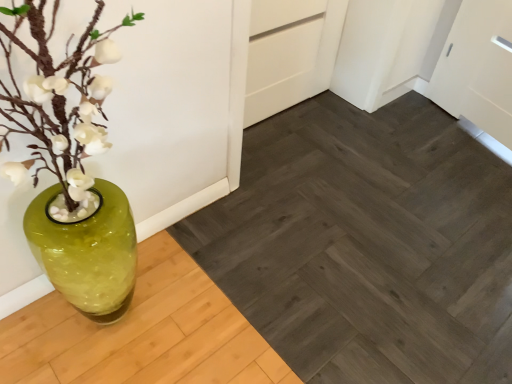
The width and height of the screenshot is (512, 384). I want to click on dark gray wood plank at center, so click(x=367, y=244).

What is the approximate width of dark gray wood plank at center?

dark gray wood plank at center is 7.97 feet wide.

Describe the element at coordinates (367, 244) in the screenshot. This screenshot has height=384, width=512. I see `dark gray wood plank at center` at that location.

You are a GUI agent. You are given a task and a screenshot of the screen. Output one action in this format:
    pyautogui.click(x=<x>, y=<y>)
    Task: Click on the green glass vase at left
    
    Given the screenshot: What is the action you would take?
    pyautogui.click(x=59, y=108)

Describe the element at coordinates (59, 108) in the screenshot. I see `green glass vase at left` at that location.

In order to click on dark gray wood plank at center in this screenshot , I will do `click(367, 244)`.

Considering the relative positions of green glass vase at left and dark gray wood plank at center in the image provided, is green glass vase at left to the right of dark gray wood plank at center from the viewer's perspective?

Incorrect, green glass vase at left is not on the right side of dark gray wood plank at center.

Is green glass vase at left closer to camera compared to dark gray wood plank at center?

That is True.

Is point (56, 144) behind point (453, 367)?

No, (56, 144) is in front of (453, 367).

From the image's perspective, is green glass vase at left positioned above or below dark gray wood plank at center?

From the image's perspective, green glass vase at left appears above dark gray wood plank at center.

From a real-world perspective, between green glass vase at left and dark gray wood plank at center, who is vertically lower?

From a 3D spatial view, dark gray wood plank at center is below.

Between green glass vase at left and dark gray wood plank at center, which one has smaller width?

green glass vase at left.

From the picture: Can you confirm if green glass vase at left is shorter than dark gray wood plank at center?

No, green glass vase at left is not shorter than dark gray wood plank at center.

Looking at the image, does green glass vase at left seem bigger or smaller compared to dark gray wood plank at center?

In the image, green glass vase at left appears to be smaller than dark gray wood plank at center.

Is green glass vase at left completely or partially outside of dark gray wood plank at center?

Yes.

Is green glass vase at left positioned far away from dark gray wood plank at center?

No, there isn't a large distance between green glass vase at left and dark gray wood plank at center.

Is green glass vase at left turned away from dark gray wood plank at center?

That's not correct — green glass vase at left is not looking away from dark gray wood plank at center.

Identify the location of houseplant lying in front of the dark gray wood plank at center. This screenshot has width=512, height=384. (59, 108).

Does dark gray wood plank at center appear on the right side of green glass vase at left?

Indeed, dark gray wood plank at center is positioned on the right side of green glass vase at left.

Is dark gray wood plank at center further to camera compared to green glass vase at left?

Yes, dark gray wood plank at center is further from the viewer.

Is point (401, 371) positioned after point (73, 69)?

Yes, point (401, 371) is farther from viewer.

From the image's perspective, is dark gray wood plank at center located above green glass vase at left?

Actually, dark gray wood plank at center appears below green glass vase at left in the image.

From a real-world perspective, is dark gray wood plank at center physically below green glass vase at left?

Yes.

Which object is wider, dark gray wood plank at center or green glass vase at left?

dark gray wood plank at center.

From the picture: Considering the relative sizes of dark gray wood plank at center and green glass vase at left in the image provided, is dark gray wood plank at center taller than green glass vase at left?

Incorrect, the height of dark gray wood plank at center is not larger of that of green glass vase at left.

Considering the relative sizes of dark gray wood plank at center and green glass vase at left in the image provided, is dark gray wood plank at center bigger than green glass vase at left?

Indeed, dark gray wood plank at center has a larger size compared to green glass vase at left.

Based on the photo, is green glass vase at left completely or partially inside dark gray wood plank at center?

No, green glass vase at left is not surrounded by dark gray wood plank at center.

Is dark gray wood plank at center far away from green glass vase at left?

Actually, dark gray wood plank at center and green glass vase at left are a little close together.

Could you tell me if dark gray wood plank at center is turned towards green glass vase at left?

No, dark gray wood plank at center does not turn towards green glass vase at left.

How many degrees apart are the facing directions of dark gray wood plank at center and green glass vase at left?

The angle between the facing direction of dark gray wood plank at center and the facing direction of green glass vase at left is 90 degrees.

Where is `houseplant located above the dark gray wood plank at center (from a real-world perspective)`? The width and height of the screenshot is (512, 384). houseplant located above the dark gray wood plank at center (from a real-world perspective) is located at coordinates pyautogui.click(x=59, y=108).

Locate an element on the screen. This screenshot has height=384, width=512. houseplant above the dark gray wood plank at center (from the image's perspective) is located at coordinates (59, 108).

Locate an element on the screen. The height and width of the screenshot is (384, 512). houseplant that appears in front of the dark gray wood plank at center is located at coordinates (59, 108).